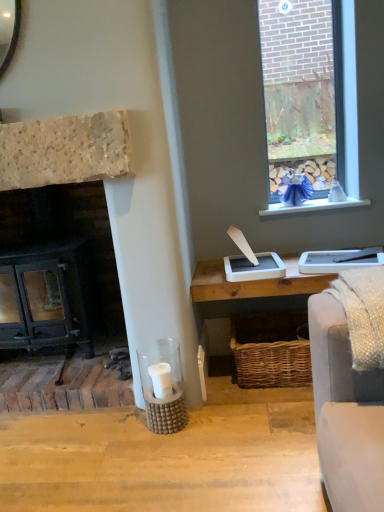
Where is `free point above white painted wood at upper right (from a real-world perspective)`? The height and width of the screenshot is (512, 384). free point above white painted wood at upper right (from a real-world perspective) is located at coordinates (313, 199).